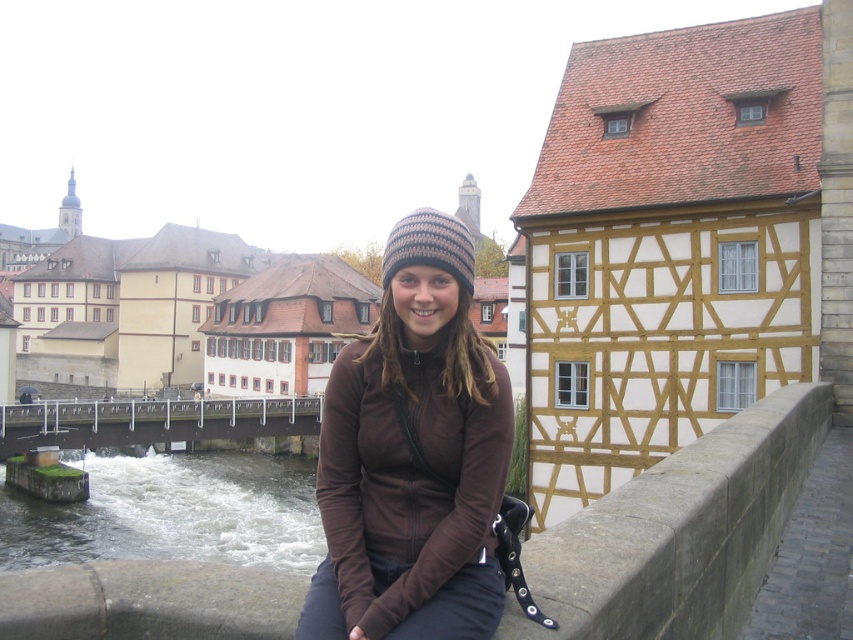
Question: Which is farther from the gray concrete ledge at lower center?

Choices:
 (A) white frothy water at lower left
 (B) metallic gray bridge at lower left

Answer: (B)

Question: Is gray concrete ledge at lower center positioned behind brown matte jacket at center?

Choices:
 (A) yes
 (B) no

Answer: (B)

Question: Is brown matte jacket at center thinner than brown fuzzy beanie at center?

Choices:
 (A) no
 (B) yes

Answer: (A)

Question: Which point is closer to the camera taking this photo?

Choices:
 (A) coord(270,410)
 (B) coord(434,248)
 (C) coord(577,534)
 (D) coord(128,307)

Answer: (C)

Question: Among these objects, which one is nearest to the camera?

Choices:
 (A) brown fuzzy beanie at center
 (B) brown knitted beanie at center

Answer: (A)

Question: Is metallic gray bridge at lower left smaller than brown fuzzy beanie at center?

Choices:
 (A) no
 (B) yes

Answer: (A)